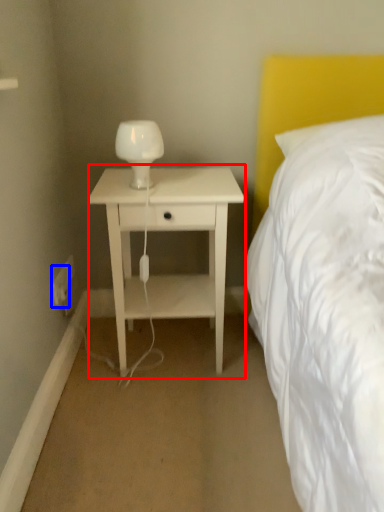
Question: Which point is further to the camera, nightstand (highlighted by a red box) or electric outlet (highlighted by a blue box)?

Choices:
 (A) nightstand
 (B) electric outlet

Answer: (B)